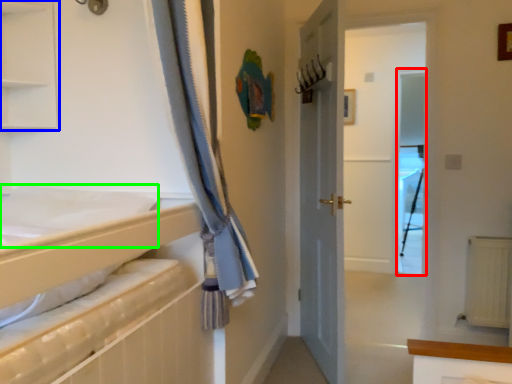
Question: Estimate the real-world distances between objects in this image. Which object is farther from screen door (highlighted by a red box), shelf (highlighted by a blue box) or sheet (highlighted by a green box)?

Choices:
 (A) shelf
 (B) sheet

Answer: (B)